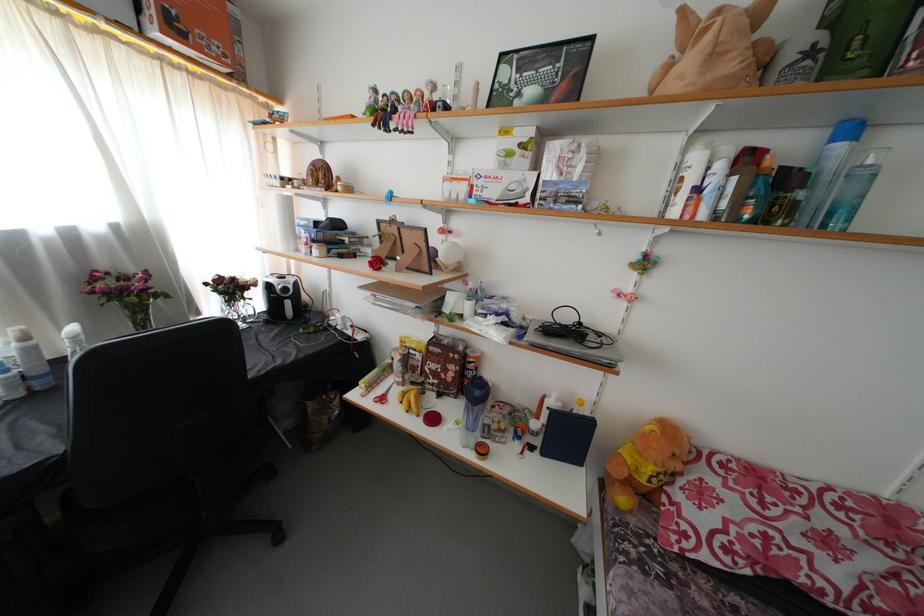
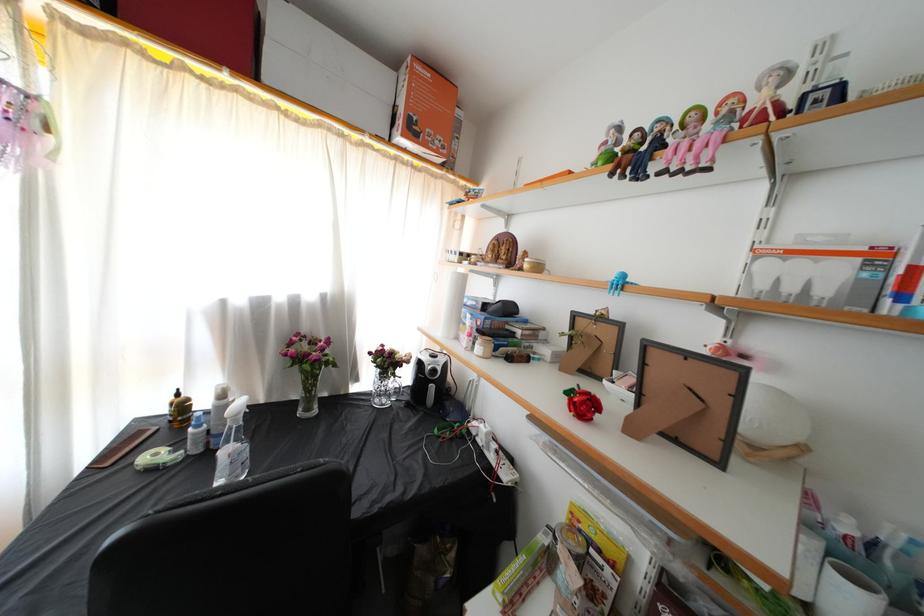
Question: The images are taken continuously from a first-person perspective. In which direction is your viewpoint rotating?

Choices:
 (A) Left
 (B) Right
 (C) Up
 (D) Down

Answer: (A)